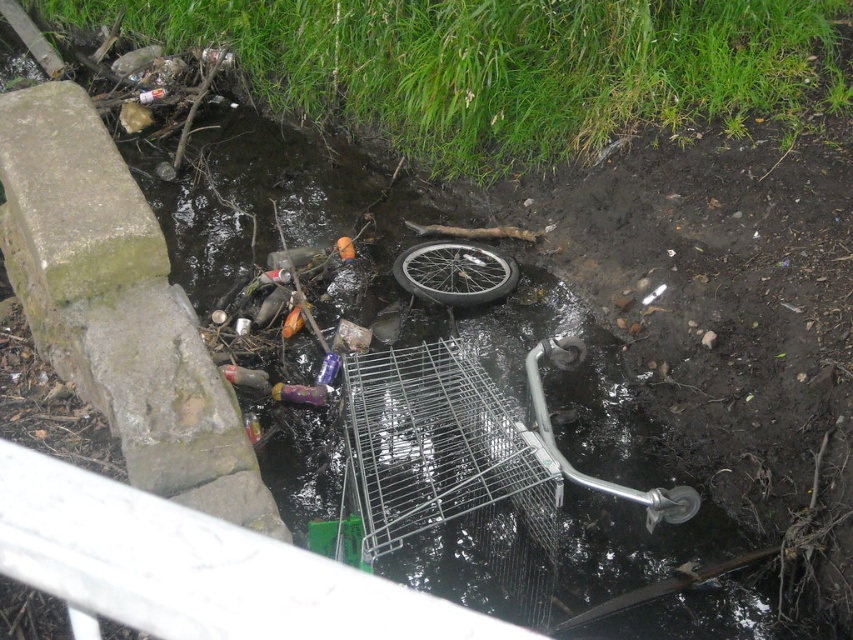
Identify the location of silver metallic cage at center. (434, 448).

Between silver metallic cage at center and metallic silver bicycle wheel at center, which one appears on the right side from the viewer's perspective?

metallic silver bicycle wheel at center is more to the right.

Find the location of a particular element. silver metallic cage at center is located at coordinates (434, 448).